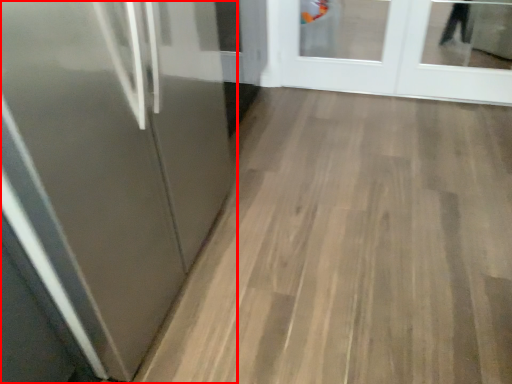
Question: Where is door (annotated by the red box) located in relation to door in the image?

Choices:
 (A) left
 (B) right

Answer: (A)